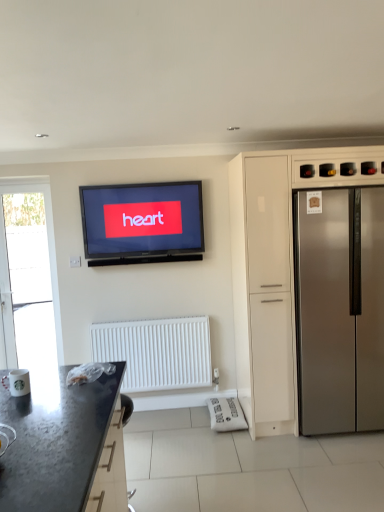
Question: Does black granite countertop at lower left come in front of satin silver refrigerator at right?

Choices:
 (A) yes
 (B) no

Answer: (A)

Question: Can you confirm if black granite countertop at lower left is thinner than satin silver refrigerator at right?

Choices:
 (A) yes
 (B) no

Answer: (B)

Question: Are black granite countertop at lower left and satin silver refrigerator at right beside each other?

Choices:
 (A) no
 (B) yes

Answer: (A)

Question: Does black granite countertop at lower left appear on the right side of satin silver refrigerator at right?

Choices:
 (A) no
 (B) yes

Answer: (A)

Question: Considering the relative sizes of black granite countertop at lower left and satin silver refrigerator at right in the image provided, is black granite countertop at lower left taller than satin silver refrigerator at right?

Choices:
 (A) no
 (B) yes

Answer: (A)

Question: From the image's perspective, is transparent glass door at left above or below stainless steel refrigerator at right?

Choices:
 (A) above
 (B) below

Answer: (A)

Question: In the image, is transparent glass door at left positioned in front of or behind stainless steel refrigerator at right?

Choices:
 (A) behind
 (B) front

Answer: (A)

Question: Does point (23, 180) appear closer or farther from the camera than point (329, 242)?

Choices:
 (A) farther
 (B) closer

Answer: (A)

Question: In terms of width, does transparent glass door at left look wider or thinner when compared to stainless steel refrigerator at right?

Choices:
 (A) thin
 (B) wide

Answer: (A)

Question: Is satin silver refrigerator at right wider or thinner than black granite countertop at lower left?

Choices:
 (A) thin
 (B) wide

Answer: (A)

Question: In terms of size, does satin silver refrigerator at right appear bigger or smaller than black granite countertop at lower left?

Choices:
 (A) small
 (B) big

Answer: (B)

Question: Would you say satin silver refrigerator at right is to the left or to the right of black granite countertop at lower left in the picture?

Choices:
 (A) right
 (B) left

Answer: (A)

Question: Is point (231, 238) positioned closer to the camera than point (51, 453)?

Choices:
 (A) closer
 (B) farther

Answer: (B)

Question: In terms of size, does satin silver refrigerator at right appear bigger or smaller than transparent glass door at left?

Choices:
 (A) big
 (B) small

Answer: (A)

Question: Considering the positions of satin silver refrigerator at right and transparent glass door at left in the image, is satin silver refrigerator at right taller or shorter than transparent glass door at left?

Choices:
 (A) tall
 (B) short

Answer: (A)